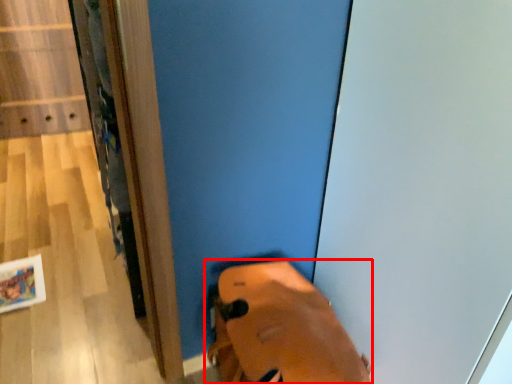
Question: In this image, where is footwear (annotated by the red box) located relative to screen door?

Choices:
 (A) right
 (B) left

Answer: (B)